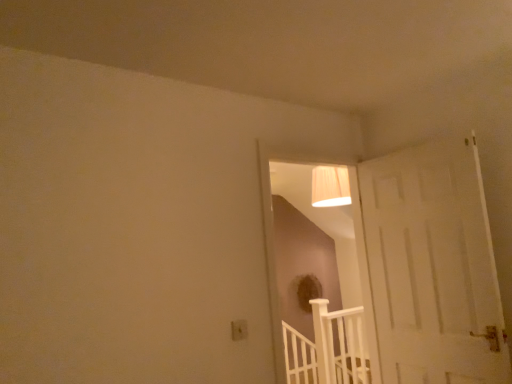
At what (x,y) coordinates should I click in order to perform the action: click on white wooden rail at lower center. Please return your answer as a coordinate pair (x, y). This screenshot has height=384, width=512. Looking at the image, I should click on (328, 348).

This screenshot has height=384, width=512. What do you see at coordinates (328, 348) in the screenshot? I see `white wooden rail at lower center` at bounding box center [328, 348].

The height and width of the screenshot is (384, 512). Describe the element at coordinates (239, 330) in the screenshot. I see `white plastic electric outlet at lower center` at that location.

At what (x,y) coordinates should I click in order to perform the action: click on white plastic electric outlet at lower center. Please return your answer as a coordinate pair (x, y). This screenshot has width=512, height=384. Looking at the image, I should click on pyautogui.click(x=239, y=330).

Image resolution: width=512 pixels, height=384 pixels. Identify the location of white wooden rail at lower center. (328, 348).

Based on their positions, is white plastic electric outlet at lower center located to the left or right of white wooden rail at lower center?

white plastic electric outlet at lower center is positioned on white wooden rail at lower center's left side.

Consider the image. Is white plastic electric outlet at lower center behind white wooden rail at lower center?

That is False.

Which is in front, point (240, 333) or point (316, 338)?

The point (240, 333) is more forward.

From the picture: From the image's perspective, which one is positioned higher, white plastic electric outlet at lower center or white wooden rail at lower center?

From the image's view, white plastic electric outlet at lower center is above.

From a real-world perspective, which object rests below the other?

From a 3D spatial view, white wooden rail at lower center is below.

Is white plastic electric outlet at lower center wider than white wooden rail at lower center?

No, white plastic electric outlet at lower center is not wider than white wooden rail at lower center.

Between white plastic electric outlet at lower center and white wooden rail at lower center, which one has more height?

white wooden rail at lower center.

Considering the sizes of objects white plastic electric outlet at lower center and white wooden rail at lower center in the image provided, who is smaller, white plastic electric outlet at lower center or white wooden rail at lower center?

With smaller size is white plastic electric outlet at lower center.

Is white plastic electric outlet at lower center located outside white wooden rail at lower center?

white plastic electric outlet at lower center lies outside white wooden rail at lower center's area.

Is white plastic electric outlet at lower center in contact with white wooden rail at lower center?

No, white plastic electric outlet at lower center is not with white wooden rail at lower center.

Is white plastic electric outlet at lower center aimed at white wooden rail at lower center?

No, white plastic electric outlet at lower center is not facing towards white wooden rail at lower center.

What are the coordinates of `rail located behind the white plastic electric outlet at lower center` in the screenshot? It's located at (328, 348).

Can you confirm if white wooden rail at lower center is positioned to the right of white plastic electric outlet at lower center?

Indeed, white wooden rail at lower center is positioned on the right side of white plastic electric outlet at lower center.

Does white wooden rail at lower center come behind white plastic electric outlet at lower center?

Yes, it is.

Which is less distant, (321,329) or (243,333)?

Point (321,329) is farther from the camera than point (243,333).

From the image's perspective, who appears lower, white wooden rail at lower center or white plastic electric outlet at lower center?

white wooden rail at lower center is shown below in the image.

From a real-world perspective, relative to white plastic electric outlet at lower center, is white wooden rail at lower center vertically above or below?

white wooden rail at lower center is situated lower than white plastic electric outlet at lower center in the real world.

In the scene shown: Is white wooden rail at lower center wider or thinner than white plastic electric outlet at lower center?

white wooden rail at lower center is wider than white plastic electric outlet at lower center.

Based on the photo, is white wooden rail at lower center taller than white plastic electric outlet at lower center?

Yes.

Can you confirm if white wooden rail at lower center is smaller than white plastic electric outlet at lower center?

Actually, white wooden rail at lower center might be larger than white plastic electric outlet at lower center.

Would you say white wooden rail at lower center is inside or outside white plastic electric outlet at lower center?

white wooden rail at lower center is not inside white plastic electric outlet at lower center, it's outside.

Is white wooden rail at lower center not close to white plastic electric outlet at lower center?

Absolutely, white wooden rail at lower center is distant from white plastic electric outlet at lower center.

Is white wooden rail at lower center turned away from white plastic electric outlet at lower center?

white wooden rail at lower center does not have its back to white plastic electric outlet at lower center.

Locate an element on the screen. rail below the white plastic electric outlet at lower center (from the image's perspective) is located at coordinates (328, 348).

What are the coordinates of `rail below the white plastic electric outlet at lower center (from the image's perspective)` in the screenshot? It's located at (328, 348).

Locate an element on the screen. electric outlet to the left of white wooden rail at lower center is located at coordinates (239, 330).